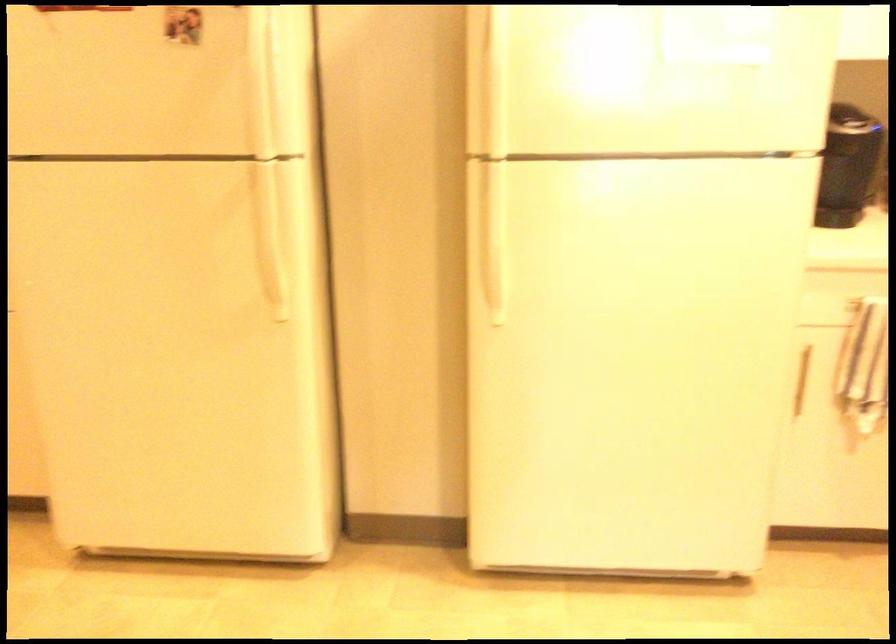
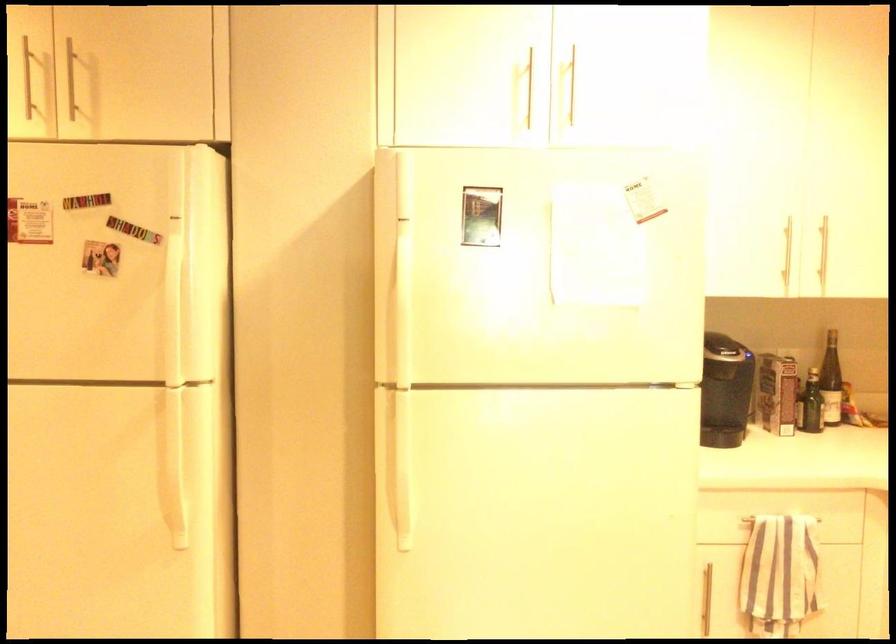
The point at (264, 68) is marked in the first image. Where is the corresponding point in the second image?

(177, 299)